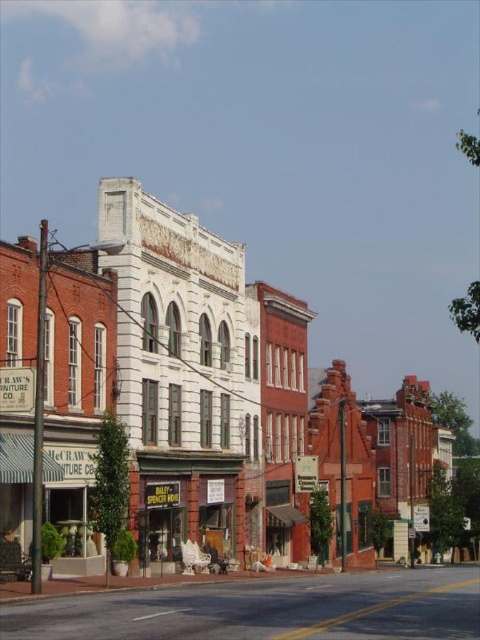
Can you confirm if white brick building at center is shorter than matte brown storefront at center?

Incorrect, white brick building at center's height does not fall short of matte brown storefront at center's.

Who is more distant from viewer, (96,394) or (219,513)?

Point (219,513)

Is point (133, 336) more distant than point (195, 502)?

No, it is in front of (195, 502).

Where is `white brick building at center`? white brick building at center is located at coordinates (170, 376).